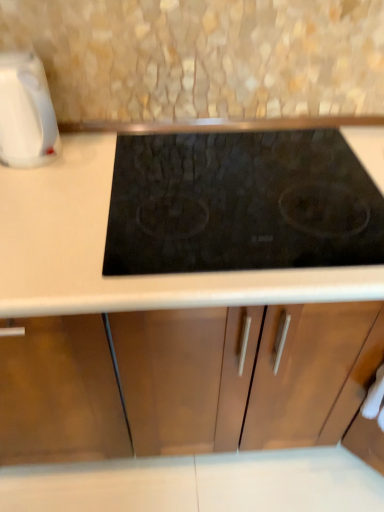
Question: From the image's perspective, is white glossy kettle at left above or below black glass cooktop at center?

Choices:
 (A) below
 (B) above

Answer: (B)

Question: From a real-world perspective, is white glossy kettle at left above or below black glass cooktop at center?

Choices:
 (A) below
 (B) above

Answer: (B)

Question: In terms of width, does white glossy kettle at left look wider or thinner when compared to black glass cooktop at center?

Choices:
 (A) thin
 (B) wide

Answer: (A)

Question: From the image's perspective, is black glass cooktop at center above or below white glossy kettle at left?

Choices:
 (A) below
 (B) above

Answer: (A)

Question: From a real-world perspective, relative to white glossy kettle at left, is black glass cooktop at center vertically above or below?

Choices:
 (A) above
 (B) below

Answer: (B)

Question: Is black glass cooktop at center taller or shorter than white glossy kettle at left?

Choices:
 (A) short
 (B) tall

Answer: (A)

Question: Is black glass cooktop at center wider or thinner than white glossy kettle at left?

Choices:
 (A) thin
 (B) wide

Answer: (B)